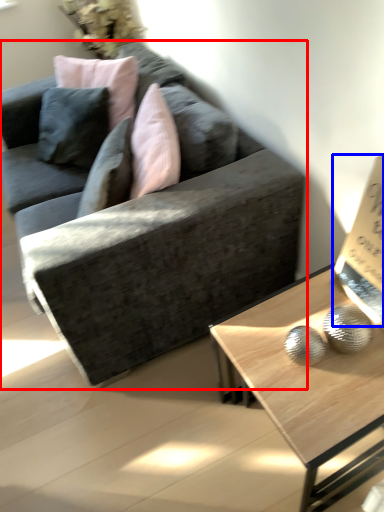
Question: Which object is further to the camera taking this photo, studio couch (highlighted by a red box) or paperback book (highlighted by a blue box)?

Choices:
 (A) studio couch
 (B) paperback book

Answer: (A)